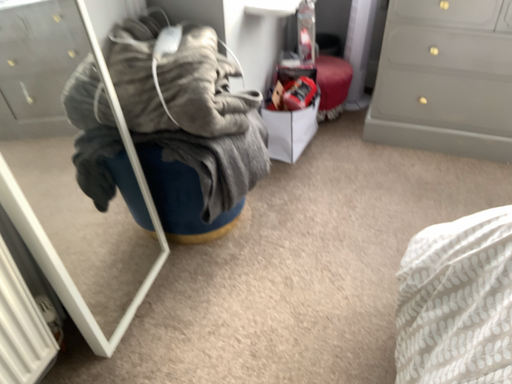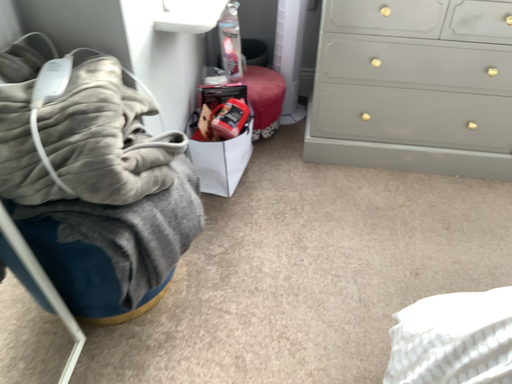
Question: How did the camera likely rotate when shooting the video?

Choices:
 (A) rotated right
 (B) rotated left

Answer: (A)